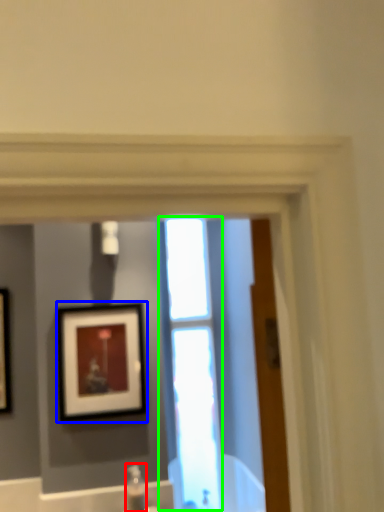
Question: Based on their relative distances, which object is nearer to plumbing fixture (highlighted by a red box)? Choose from picture frame (highlighted by a blue box) and window (highlighted by a green box).

Choices:
 (A) picture frame
 (B) window

Answer: (A)